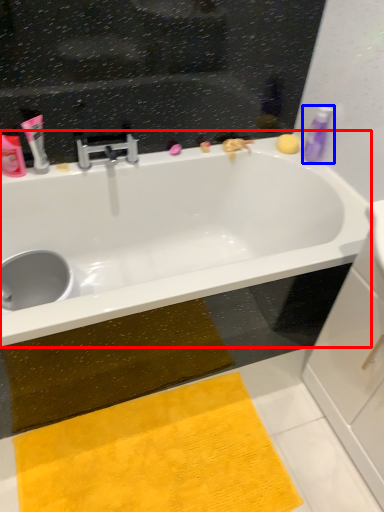
Question: Which object is further to the camera taking this photo, bathtub (highlighted by a red box) or toiletry (highlighted by a blue box)?

Choices:
 (A) bathtub
 (B) toiletry

Answer: (B)